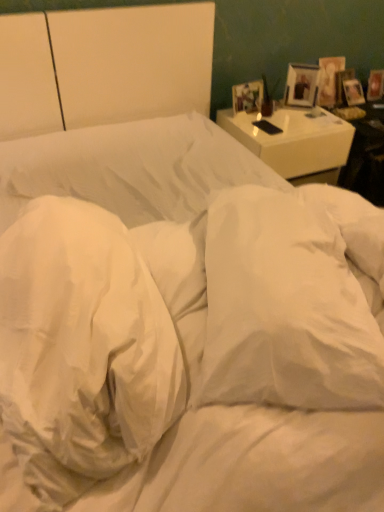
Question: Is wooden picture frame at upper right, the second picture frame when ordered from front to back, situated inside white soft pillow at center, acting as the 1th pillow starting from the left, or outside?

Choices:
 (A) outside
 (B) inside

Answer: (A)

Question: Looking at the image, does wooden picture frame at upper right, the 2th picture frame positioned from the back, seem bigger or smaller compared to white soft pillow at center, acting as the 1th pillow starting from the left?

Choices:
 (A) big
 (B) small

Answer: (B)

Question: Which of these objects is positioned farthest from the white soft pillow at center, acting as the 1th pillow starting from the left?

Choices:
 (A) wooden picture frame at upper right, which appears as the third picture frame when viewed from the front
 (B) wooden picture frame at upper right, the second picture frame when ordered from front to back
 (C) white glossy nightstand at upper right
 (D) white soft pillow at center, positioned as the 1th pillow in right-to-left order
 (E) matte wooden picture frame at upper right, which is counted as the third picture frame, starting from the back

Answer: (A)

Question: Based on their relative distances, which object is farther from the white soft pillow at center, the second pillow when ordered from right to left?

Choices:
 (A) white glossy nightstand at upper right
 (B) wooden picture frame at upper right, the 2th picture frame positioned from the back
 (C) matte wooden picture frame at upper right, placed as the third picture frame when sorted from right to left
 (D) white soft pillow at center, positioned as the 1th pillow in right-to-left order
 (E) wooden picture frame at upper right, which appears as the third picture frame when viewed from the front

Answer: (E)